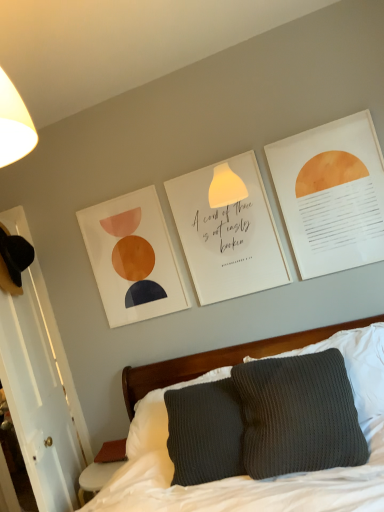
I want to click on matte orange circle at upper right, acting as the 2th postcard starting from the left, so click(x=331, y=194).

Where is `knitted gray pillow at center`? This screenshot has height=512, width=384. knitted gray pillow at center is located at coordinates (211, 484).

This screenshot has height=512, width=384. Describe the element at coordinates (228, 234) in the screenshot. I see `white paper at center, arranged as the first postcard when viewed from the left` at that location.

The image size is (384, 512). What do you see at coordinates (132, 258) in the screenshot?
I see `matte paper picture frame at upper center` at bounding box center [132, 258].

This screenshot has width=384, height=512. In order to click on matte paper picture frame at upper center in this screenshot , I will do `click(132, 258)`.

Measure the distance between point (302, 386) and camera.

1.61 meters.

Where is `matte orange circle at upper right, the first postcard viewed from the front`? Image resolution: width=384 pixels, height=512 pixels. matte orange circle at upper right, the first postcard viewed from the front is located at coordinates (331, 194).

Which of these two, matte orange circle at upper right, the 1th postcard from the right, or matte paper picture frame at upper center, is bigger?

Bigger between the two is matte orange circle at upper right, the 1th postcard from the right.

Is matte orange circle at upper right, the first postcard viewed from the front, not within matte paper picture frame at upper center?

matte orange circle at upper right, the first postcard viewed from the front, lies outside matte paper picture frame at upper center's area.

Based on their positions, is matte orange circle at upper right, placed as the second postcard when sorted from back to front, located to the left or right of matte paper picture frame at upper center?

Clearly, matte orange circle at upper right, placed as the second postcard when sorted from back to front, is on the right of matte paper picture frame at upper center in the image.

Measure the distance from matte orange circle at upper right, the 1th postcard from the right, to matte paper picture frame at upper center.

89.05 centimeters.

Are matte paper picture frame at upper center and dark gray knitted pillow at center beside each other?

No, matte paper picture frame at upper center is not with dark gray knitted pillow at center.

Could you tell me if matte paper picture frame at upper center is facing dark gray knitted pillow at center?

No, matte paper picture frame at upper center does not turn towards dark gray knitted pillow at center.

Which is more to the right, matte paper picture frame at upper center or dark gray knitted pillow at center?

Positioned to the right is dark gray knitted pillow at center.

Considering the positions of objects matte paper picture frame at upper center and dark gray knitted pillow at center in the image provided, who is behind, matte paper picture frame at upper center or dark gray knitted pillow at center?

matte paper picture frame at upper center is behind.

Is knitted gray pillow at center completely or partially inside white paper at center, the 1th postcard positioned from the back?

Definitely not — knitted gray pillow at center is not inside white paper at center, the 1th postcard positioned from the back.

Where is `bed that appears below the white paper at center, arranged as the first postcard when viewed from the left (from a real-world perspective)`? Image resolution: width=384 pixels, height=512 pixels. bed that appears below the white paper at center, arranged as the first postcard when viewed from the left (from a real-world perspective) is located at coordinates (211, 484).

Considering the relative sizes of white paper at center, the second postcard from the right, and knitted gray pillow at center in the image provided, is white paper at center, the second postcard from the right, thinner than knitted gray pillow at center?

Indeed, white paper at center, the second postcard from the right, has a lesser width compared to knitted gray pillow at center.

From the image's perspective, is white paper at center, arranged as the first postcard when viewed from the left, positioned above or below knitted gray pillow at center?

white paper at center, arranged as the first postcard when viewed from the left, is situated higher than knitted gray pillow at center in the image.

Locate an element on the screen. Image resolution: width=384 pixels, height=512 pixels. postcard below the matte paper picture frame at upper center (from a real-world perspective) is located at coordinates (228, 234).

Is white paper at center, arranged as the first postcard when viewed from the left, turned away from matte paper picture frame at upper center?

No.

In the scene shown: Is white paper at center, the second postcard in the front-to-back sequence, to the right of matte paper picture frame at upper center from the viewer's perspective?

Indeed, white paper at center, the second postcard in the front-to-back sequence, is positioned on the right side of matte paper picture frame at upper center.

Is white paper at center, the second postcard in the front-to-back sequence, turned away from dark gray knitted pillow at center?

No, dark gray knitted pillow at center is not at the back of white paper at center, the second postcard in the front-to-back sequence.

Is white paper at center, the second postcard in the front-to-back sequence, placed right next to dark gray knitted pillow at center?

There is a gap between white paper at center, the second postcard in the front-to-back sequence, and dark gray knitted pillow at center.

Choose the correct answer: Is white paper at center, the second postcard in the front-to-back sequence, inside dark gray knitted pillow at center or outside it?

white paper at center, the second postcard in the front-to-back sequence, lies outside dark gray knitted pillow at center.

Is knitted gray pillow at center beside dark gray knitted pillow at center?

They are not placed beside each other.

From a real-world perspective, is knitted gray pillow at center located higher than dark gray knitted pillow at center?

No, from a real-world perspective, knitted gray pillow at center is not over dark gray knitted pillow at center

Considering the sizes of objects knitted gray pillow at center and dark gray knitted pillow at center in the image provided, who is smaller, knitted gray pillow at center or dark gray knitted pillow at center?

dark gray knitted pillow at center.

Locate an element on the screen. This screenshot has width=384, height=512. pillow directly beneath the matte paper picture frame at upper center (from a real-world perspective) is located at coordinates (298, 415).

Can you confirm if dark gray knitted pillow at center is positioned to the right of matte paper picture frame at upper center?

Yes, dark gray knitted pillow at center is to the right of matte paper picture frame at upper center.

In terms of width, does dark gray knitted pillow at center look wider or thinner when compared to matte paper picture frame at upper center?

Considering their sizes, dark gray knitted pillow at center looks broader than matte paper picture frame at upper center.

What's the angular difference between dark gray knitted pillow at center and matte paper picture frame at upper center's facing directions?

0.761 degrees separate the facing orientations of dark gray knitted pillow at center and matte paper picture frame at upper center.

This screenshot has width=384, height=512. In the image, there is a matte orange circle at upper right, placed as the second postcard when sorted from back to front. In order to click on picture frame below it (from a real-world perspective) in this screenshot , I will do `click(132, 258)`.

This screenshot has height=512, width=384. I want to click on picture frame that appears behind the dark gray knitted pillow at center, so click(132, 258).

When comparing their distances from knitted gray pillow at center, does white paper at center, the second postcard from the right, or dark gray knitted pillow at center seem further?

white paper at center, the second postcard from the right, is positioned further to the anchor knitted gray pillow at center.

Considering their positions, is matte orange circle at upper right, placed as the second postcard when sorted from back to front, positioned further to knitted gray pillow at center than white paper at center, the 1th postcard positioned from the back?

Based on the image, matte orange circle at upper right, placed as the second postcard when sorted from back to front, appears to be further to knitted gray pillow at center.

Considering their positions, is knitted gray pillow at center positioned further to matte paper picture frame at upper center than matte orange circle at upper right, placed as the second postcard when sorted from back to front?

matte orange circle at upper right, placed as the second postcard when sorted from back to front, is positioned further to the anchor matte paper picture frame at upper center.

Looking at the image, which one is located closer to white paper at center, arranged as the first postcard when viewed from the left, matte orange circle at upper right, the first postcard viewed from the front, or knitted gray pillow at center?

The object closer to white paper at center, arranged as the first postcard when viewed from the left, is matte orange circle at upper right, the first postcard viewed from the front.

Which object lies nearer to the anchor point dark gray knitted pillow at center, matte paper picture frame at upper center or matte orange circle at upper right, acting as the 2th postcard starting from the left?

The object closer to dark gray knitted pillow at center is matte orange circle at upper right, acting as the 2th postcard starting from the left.

Looking at the image, which one is located closer to matte paper picture frame at upper center, matte orange circle at upper right, the first postcard viewed from the front, or dark gray knitted pillow at center?

matte orange circle at upper right, the first postcard viewed from the front, lies closer to matte paper picture frame at upper center than the other object.

When comparing their distances from matte orange circle at upper right, the first postcard viewed from the front, does white paper at center, the second postcard in the front-to-back sequence, or knitted gray pillow at center seem closer?

white paper at center, the second postcard in the front-to-back sequence, lies closer to matte orange circle at upper right, the first postcard viewed from the front, than the other object.

From the image, which object appears to be farther from knitted gray pillow at center, white paper at center, the second postcard from the right, or matte paper picture frame at upper center?

matte paper picture frame at upper center.

Locate an element on the screen. pillow between knitted gray pillow at center and matte orange circle at upper right, the first postcard viewed from the front, along the z-axis is located at coordinates (298, 415).

You are a GUI agent. You are given a task and a screenshot of the screen. Output one action in this format:
    pyautogui.click(x=<x>, y=<y>)
    Task: Click on the postcard between matte orange circle at upper right, acting as the 2th postcard starting from the left, and dark gray knitted pillow at center in the up-down direction
    This screenshot has width=384, height=512.
    Given the screenshot: What is the action you would take?
    pyautogui.click(x=228, y=234)

Locate an element on the screen. The image size is (384, 512). postcard between matte paper picture frame at upper center and matte orange circle at upper right, the first postcard viewed from the front, from left to right is located at coordinates (228, 234).

Identify the location of postcard between knitted gray pillow at center and white paper at center, the 1th postcard positioned from the back, in the front-back direction. (331, 194).